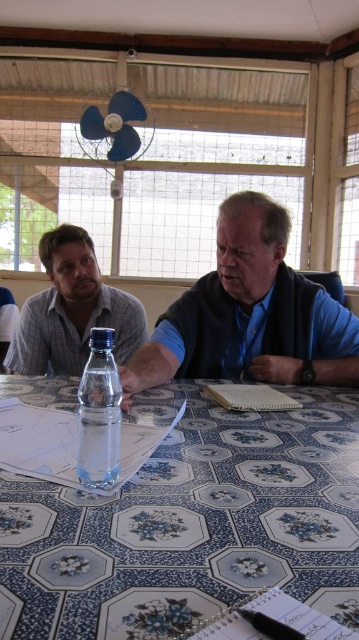
Is blue fabric vest at center bigger than matte gray shirt at left?

Yes.

Between blue fabric vest at center and matte gray shirt at left, which one appears on the right side from the viewer's perspective?

Positioned to the right is blue fabric vest at center.

Identify the location of blue fabric vest at center. (249, 314).

You are a GUI agent. You are given a task and a screenshot of the screen. Output one action in this format:
    pyautogui.click(x=<x>, y=<y>)
    Task: Click on the blue fabric vest at center
    The width and height of the screenshot is (359, 640).
    Given the screenshot: What is the action you would take?
    pyautogui.click(x=249, y=314)

Does blue fabric vest at center have a greater width compared to clear plastic bottle at center?

Correct, the width of blue fabric vest at center exceeds that of clear plastic bottle at center.

Does blue fabric vest at center have a lesser height compared to clear plastic bottle at center?

In fact, blue fabric vest at center may be taller than clear plastic bottle at center.

Is point (276, 333) positioned after point (108, 371)?

Yes, it is behind point (108, 371).

Locate an element on the screen. The width and height of the screenshot is (359, 640). blue fabric vest at center is located at coordinates (249, 314).

Between clear plastic bottle at center and clear glass water at table center, which one is positioned higher?

clear plastic bottle at center is higher up.

Looking at this image, who is taller, clear plastic bottle at center or clear glass water at table center?

clear plastic bottle at center is taller.

Between point (98, 364) and point (80, 408), which one is positioned behind?

Point (80, 408)

Where is `clear plastic bottle at center`? clear plastic bottle at center is located at coordinates (99, 413).